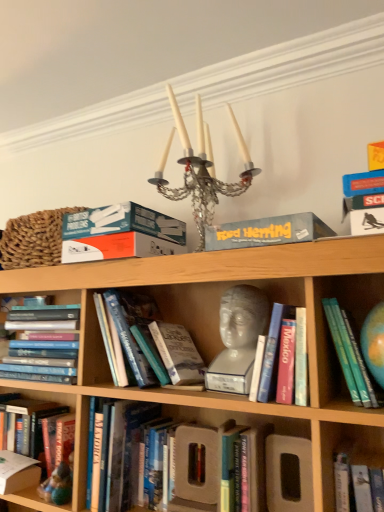
Locate an element on the screen. The height and width of the screenshot is (512, 384). free space above hardcover book at lower left, which is the fifth book from right to left (from a real-world perspective) is located at coordinates (35, 407).